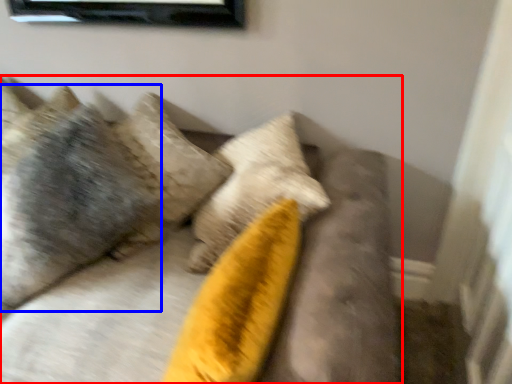
Question: Which of the following is the closest to the observer, furniture (highlighted by a red box) or pillow (highlighted by a blue box)?

Choices:
 (A) furniture
 (B) pillow

Answer: (A)